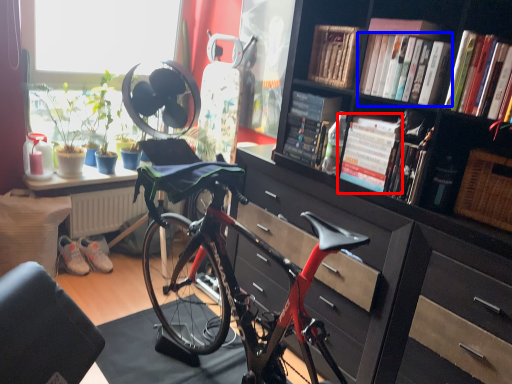
Question: Among these objects, which one is nearest to the camera, book (highlighted by a red box) or book (highlighted by a blue box)?

Choices:
 (A) book
 (B) book

Answer: (B)